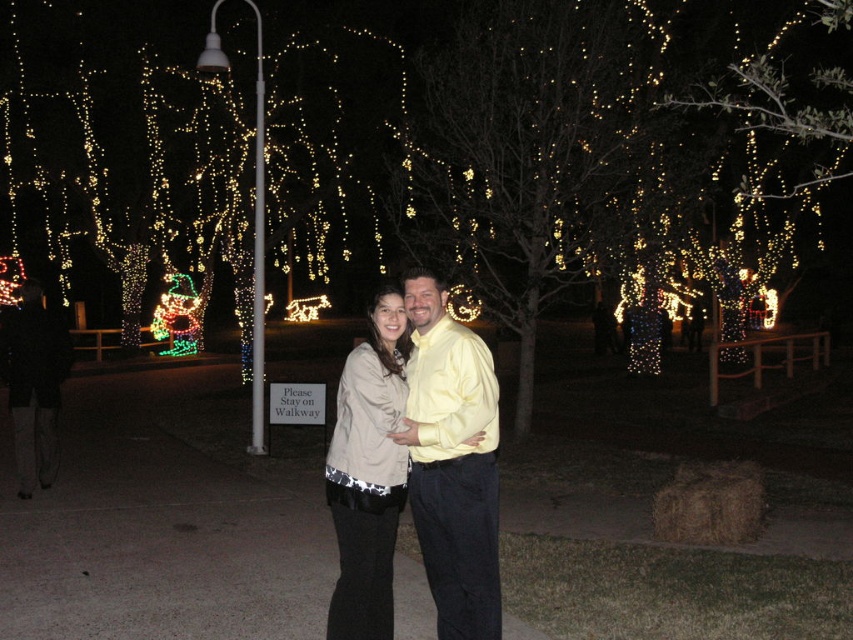
What do you see at coordinates (451, 461) in the screenshot? I see `matte beige jacket at center` at bounding box center [451, 461].

Locate an element on the screen. This screenshot has height=640, width=853. matte beige jacket at center is located at coordinates (451, 461).

Image resolution: width=853 pixels, height=640 pixels. I want to click on matte beige jacket at center, so click(x=451, y=461).